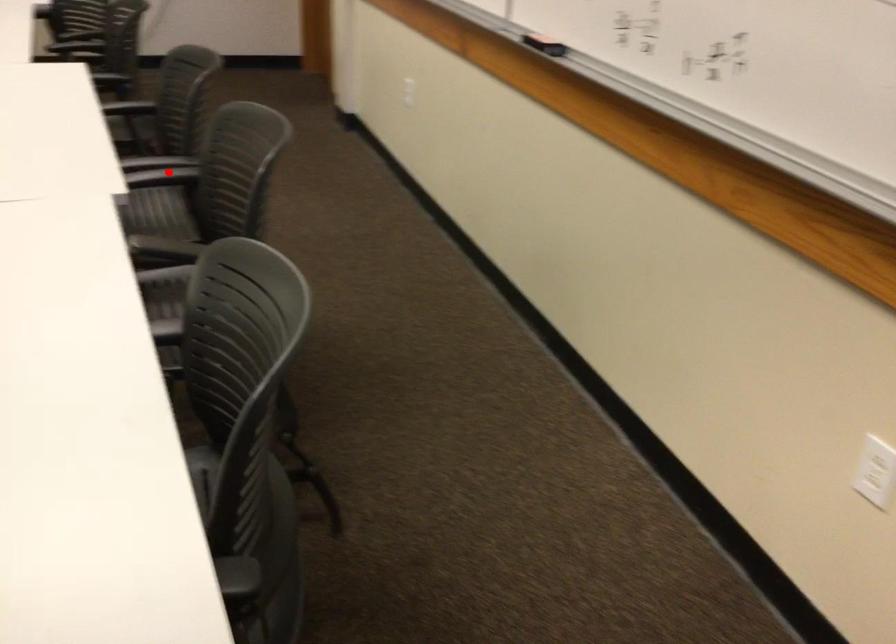
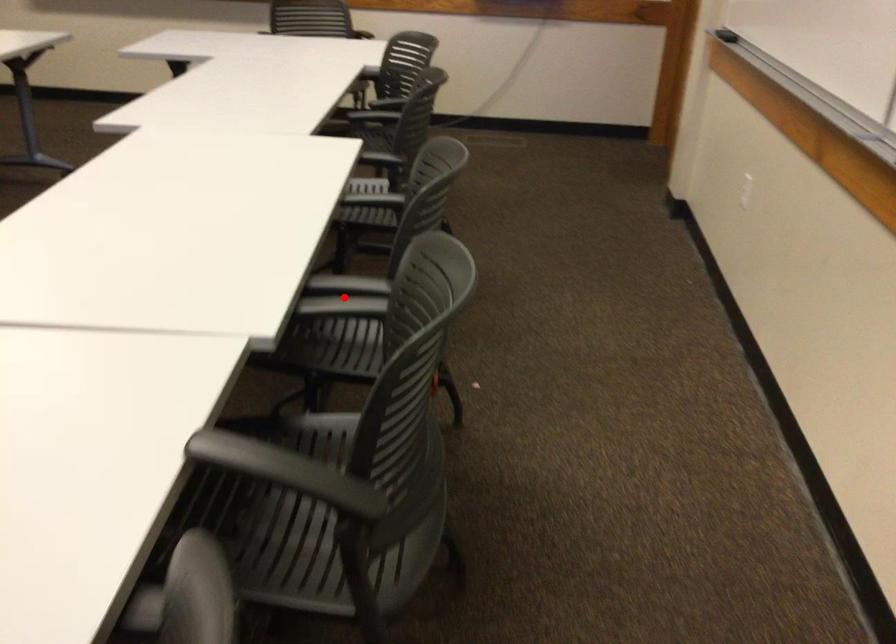
I am providing you with two images of the same scene from different viewpoints. A red point is marked on the first image and another point is marked on the second image. Does the point marked in image1 correspond to the same location as the one in image2?

Yes